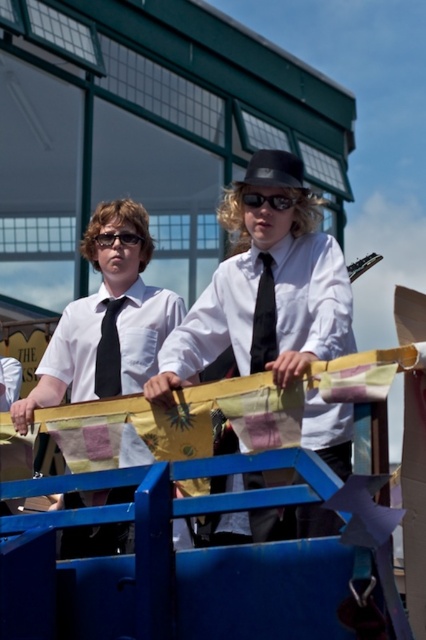
You are a tailor measuring items for alterations. You need to determine which item, the matte black shirt at center or the black satin tie at center, requires a longer vertical adjustment to fit properly. Based on their heights, which item should you prioritize?

The matte black shirt at center has a greater height compared to the black satin tie at center, so the matte black shirt at center requires a longer vertical adjustment and should be prioritized.

Consider the image. What is the exact coordinate of the black satin tie at center?

The black satin tie at center is located at point (x=264, y=317).

You are a photographer trying to capture a clear shot of the matte black shirt at center. Based on the scene description, where should you position your camera to ensure the shirt is in the frame?

The matte black shirt at center is located at point (106, 320), so positioning the camera to focus on that coordinate will ensure the shirt is centered in the frame.